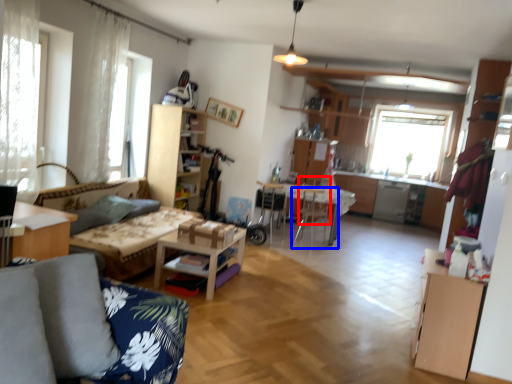
Question: Which object appears closest to the camera in this image, armchair (highlighted by a red box) or chair (highlighted by a blue box)?

Choices:
 (A) armchair
 (B) chair

Answer: (B)